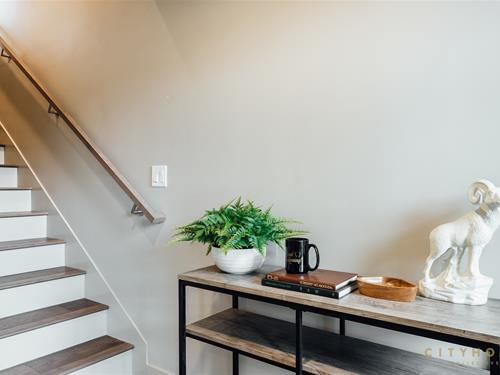
Image resolution: width=500 pixels, height=375 pixels. I want to click on plant, so click(x=239, y=235).